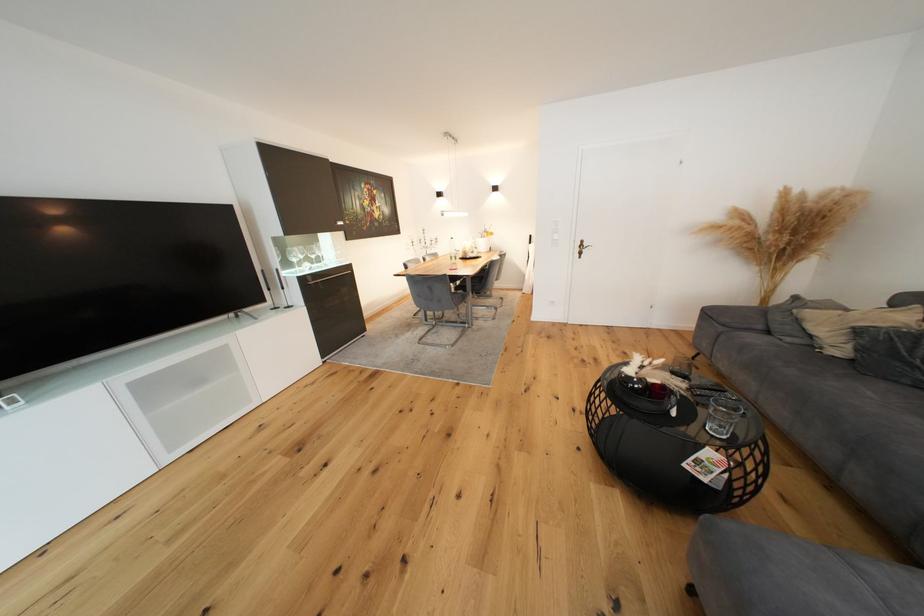
The height and width of the screenshot is (616, 924). What do you see at coordinates (554, 238) in the screenshot? I see `the wall light switch` at bounding box center [554, 238].